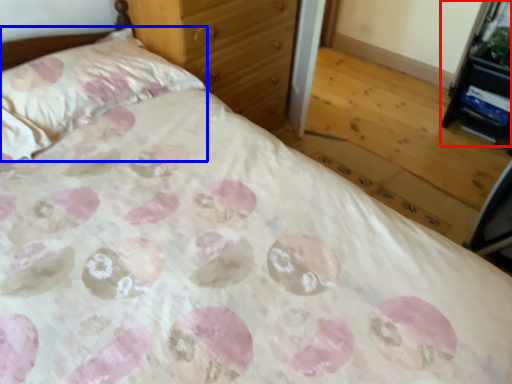
Question: Which object appears closest to the camera in this image, vanity (highlighted by a red box) or pillow (highlighted by a blue box)?

Choices:
 (A) vanity
 (B) pillow

Answer: (B)